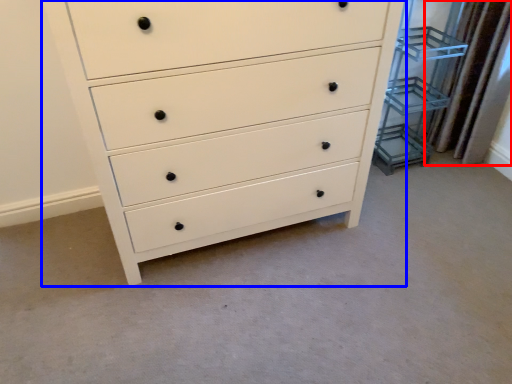
Question: Which of the following is the farthest to the observer, curtain (highlighted by a red box) or chest of drawers (highlighted by a blue box)?

Choices:
 (A) curtain
 (B) chest of drawers

Answer: (A)